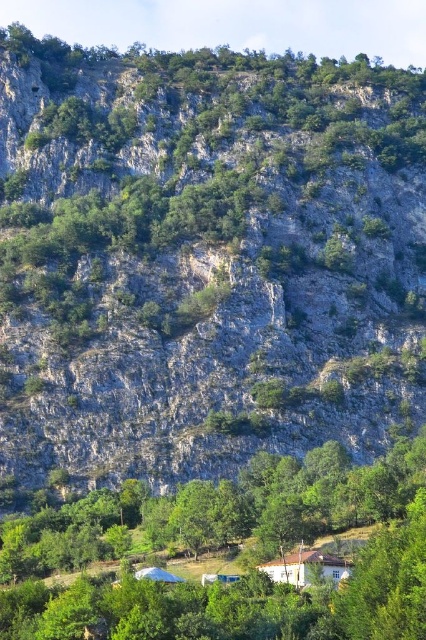
You are hiking and want to take a photo of both the green leafy tree at center and the white wooden house at lower center. Since you want both in focus, you need to know which one is closer to you. Which one is nearer?

The green leafy tree at center is closer to the viewer than the white wooden house at lower center, so it is nearer to you.

You are planning to build a hiking trail that goes from the base of the steep cliff to the white wooden house at lower center. The trail must avoid the green leafy tree at center. Which direction should the trail go around the tree?

The trail should go around the green leafy tree at center to the right since the tree is to the left of the white wooden house at lower center, so going right would bypass it towards the house.

You are planning to build a new garden shed in your backyard. You have a space that can accommodate a structure up to the width of the white wooden house at lower center. You see the green leafy tree at center in the image. Will the tree fit within your available space if you were to transplant it there?

The green leafy tree at center might be wider than the white wooden house at lower center, so there is a possibility that the tree may not fit within the available space. It is recommended to measure the tree or consult a professional before transplanting.